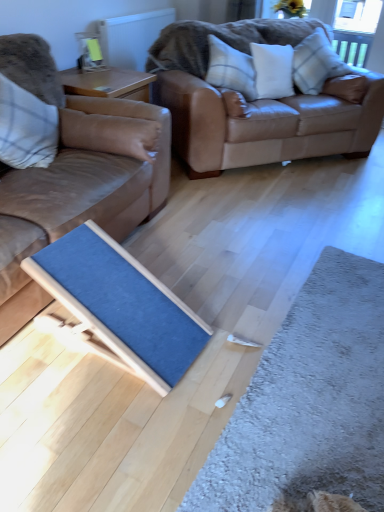
Question: Which direction should I rotate to look at plaid fabric pillow at upper center, the second pillow positioned from the left?

Choices:
 (A) left
 (B) right

Answer: (B)

Question: Is matte brown leather couch at left, which is the 1th studio couch in left-to-right order, at the back of clear glass window screen at upper right?

Choices:
 (A) yes
 (B) no

Answer: (B)

Question: Is clear glass window screen at upper right bigger than matte brown leather couch at left, which is the 1th studio couch in left-to-right order?

Choices:
 (A) yes
 (B) no

Answer: (B)

Question: Is clear glass window screen at upper right shorter than matte brown leather couch at left, positioned as the second studio couch in right-to-left order?

Choices:
 (A) no
 (B) yes

Answer: (B)

Question: Is clear glass window screen at upper right not close to matte brown leather couch at left, positioned as the second studio couch in right-to-left order?

Choices:
 (A) no
 (B) yes

Answer: (B)

Question: Is clear glass window screen at upper right positioned behind matte brown leather couch at left, positioned as the second studio couch in right-to-left order?

Choices:
 (A) no
 (B) yes

Answer: (B)

Question: Can you see clear glass window screen at upper right touching matte brown leather couch at left, which is the 1th studio couch in left-to-right order?

Choices:
 (A) no
 (B) yes

Answer: (A)

Question: Does blue fabric doormat at center, which ranks as the second doormat in right-to-left order, lie behind white fabric pillow at upper center, the second pillow viewed from the right?

Choices:
 (A) yes
 (B) no

Answer: (B)

Question: From the image's perspective, does blue fabric doormat at center, which ranks as the second doormat in right-to-left order, appear higher than white fabric pillow at upper center, the second pillow viewed from the right?

Choices:
 (A) yes
 (B) no

Answer: (B)

Question: From a real-world perspective, is blue fabric doormat at center, which is the first doormat from left to right, on white fabric pillow at upper center, the second pillow viewed from the right?

Choices:
 (A) no
 (B) yes

Answer: (A)

Question: From a real-world perspective, is blue fabric doormat at center, which ranks as the second doormat in right-to-left order, below white fabric pillow at upper center, the third pillow from the left?

Choices:
 (A) yes
 (B) no

Answer: (A)

Question: Can you confirm if blue fabric doormat at center, which ranks as the second doormat in right-to-left order, is taller than white fabric pillow at upper center, the second pillow viewed from the right?

Choices:
 (A) yes
 (B) no

Answer: (A)

Question: Is blue fabric doormat at center, which ranks as the second doormat in right-to-left order, far away from white fabric pillow at upper center, the second pillow viewed from the right?

Choices:
 (A) no
 (B) yes

Answer: (B)

Question: Is plaid fabric pillow at upper right, which is the fourth pillow in left-to-right order, inside clear glass window screen at upper right?

Choices:
 (A) yes
 (B) no

Answer: (B)